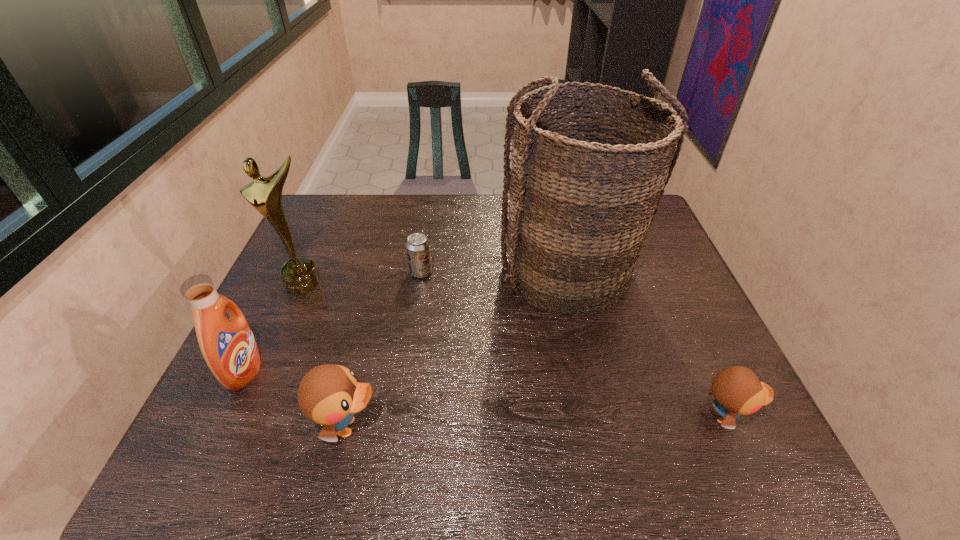
Where is `location for an additional duck to make spacing equal`? location for an additional duck to make spacing equal is located at coordinates click(x=539, y=422).